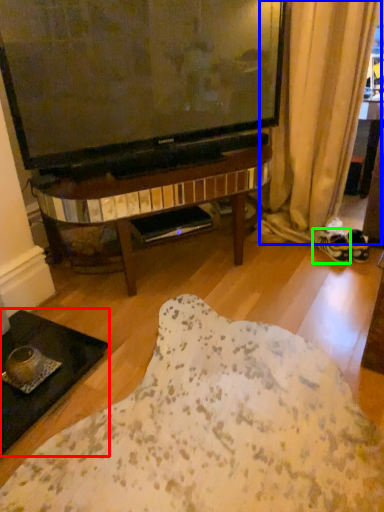
Question: Which is nearer to the coffee table (highlighted by a red box)? curtain (highlighted by a blue box) or footwear (highlighted by a green box).

Choices:
 (A) curtain
 (B) footwear

Answer: (B)